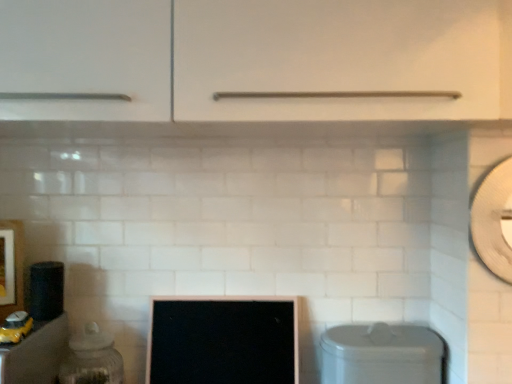
Question: Is clear glass jar at left, arranged as the 2th appliance when viewed from the top, not near wooden framed picture at left?

Choices:
 (A) no
 (B) yes

Answer: (A)

Question: Is clear glass jar at left, acting as the first appliance starting from the right, further to camera compared to wooden framed picture at left?

Choices:
 (A) yes
 (B) no

Answer: (A)

Question: Is clear glass jar at left, acting as the first appliance starting from the right, thinner than wooden framed picture at left?

Choices:
 (A) yes
 (B) no

Answer: (B)

Question: Is clear glass jar at left, which is the first appliance from bottom to top, at the right side of wooden framed picture at left?

Choices:
 (A) no
 (B) yes

Answer: (B)

Question: Is clear glass jar at left, acting as the first appliance starting from the right, bigger than wooden framed picture at left?

Choices:
 (A) no
 (B) yes

Answer: (B)

Question: Would you say matte black speaker at left, placed as the 1th appliance when sorted from left to right, is to the left or to the right of wooden framed picture at left in the picture?

Choices:
 (A) left
 (B) right

Answer: (B)

Question: Is matte black speaker at left, the 1th appliance from the top, spatially inside wooden framed picture at left, or outside of it?

Choices:
 (A) outside
 (B) inside

Answer: (A)

Question: Is matte black speaker at left, the second appliance in the bottom-to-top sequence, wider or thinner than wooden framed picture at left?

Choices:
 (A) wide
 (B) thin

Answer: (A)

Question: Considering their positions, is matte black speaker at left, the second appliance in the bottom-to-top sequence, located in front of or behind wooden framed picture at left?

Choices:
 (A) front
 (B) behind

Answer: (B)

Question: Is point (72, 372) positioned closer to the camera than point (11, 286)?

Choices:
 (A) closer
 (B) farther

Answer: (A)

Question: In terms of size, does clear glass jar at left, which is the first appliance from bottom to top, appear bigger or smaller than wooden framed picture at left?

Choices:
 (A) small
 (B) big

Answer: (B)

Question: In the image, is clear glass jar at left, which is counted as the 2th appliance, starting from the left, positioned in front of or behind wooden framed picture at left?

Choices:
 (A) behind
 (B) front

Answer: (A)

Question: From a real-world perspective, is clear glass jar at left, acting as the first appliance starting from the right, above or below wooden framed picture at left?

Choices:
 (A) below
 (B) above

Answer: (A)

Question: Is black glossy computer monitor at center to the left or to the right of wooden framed picture at left in the image?

Choices:
 (A) right
 (B) left

Answer: (A)

Question: Is black glossy computer monitor at center wider or thinner than wooden framed picture at left?

Choices:
 (A) wide
 (B) thin

Answer: (A)